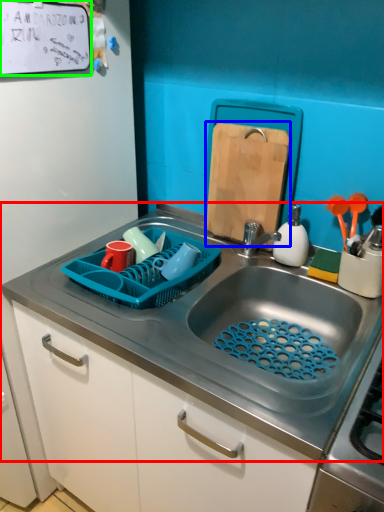
Question: Which object is positioned closest to sink (highlighted by a red box)? Select from cutting board (highlighted by a blue box) and bulletin board (highlighted by a green box).

Choices:
 (A) cutting board
 (B) bulletin board

Answer: (A)